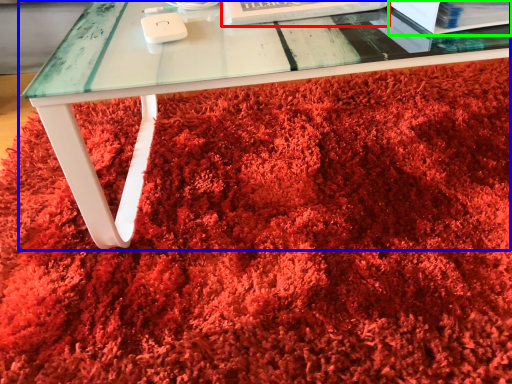
Question: Based on their relative distances, which object is farther from paperback book (highlighted by a red box)? Choose from table (highlighted by a blue box) and paperback book (highlighted by a green box).

Choices:
 (A) table
 (B) paperback book

Answer: (A)